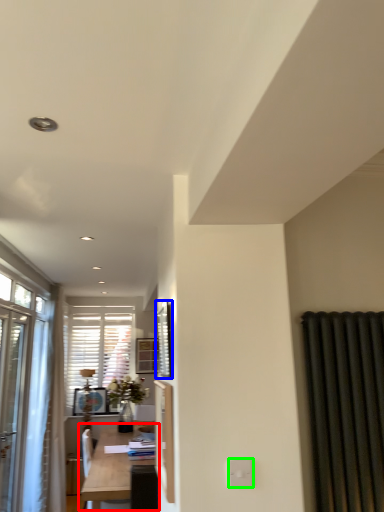
Question: Which object is positioned farthest from table (highlighted by a red box)? Select from window screen (highlighted by a blue box) and electric outlet (highlighted by a green box).

Choices:
 (A) window screen
 (B) electric outlet

Answer: (B)